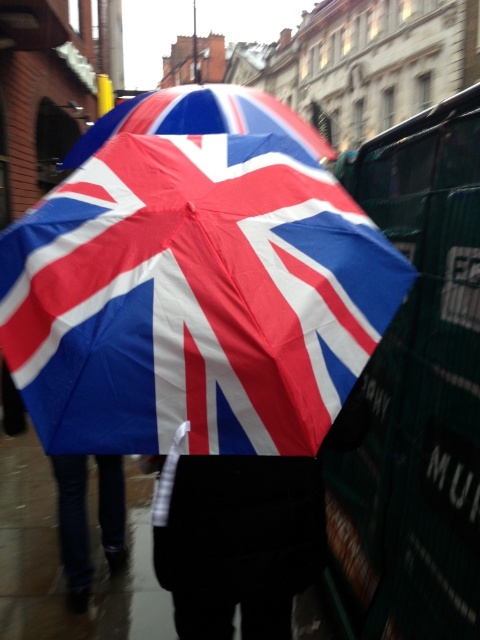
Question: Is matte plastic umbrella at center wider than jeans at lower left?

Choices:
 (A) no
 (B) yes

Answer: (B)

Question: Estimate the real-world distances between objects in this image. Which object is farther from the jeans at lower left?

Choices:
 (A) velvet black coat at center
 (B) matte plastic umbrella at center
 (C) polyester umbrella at center

Answer: (B)

Question: Does matte plastic umbrella at center appear under jeans at lower left?

Choices:
 (A) no
 (B) yes

Answer: (A)

Question: Which point appears farthest from the camera in this image?

Choices:
 (A) (299, 371)
 (B) (110, 540)
 (C) (311, 536)

Answer: (B)

Question: Based on their relative distances, which object is nearer to the jeans at lower left?

Choices:
 (A) polyester umbrella at center
 (B) velvet black coat at center
 (C) matte plastic umbrella at center

Answer: (B)

Question: Does polyester umbrella at center lie behind matte plastic umbrella at center?

Choices:
 (A) yes
 (B) no

Answer: (B)